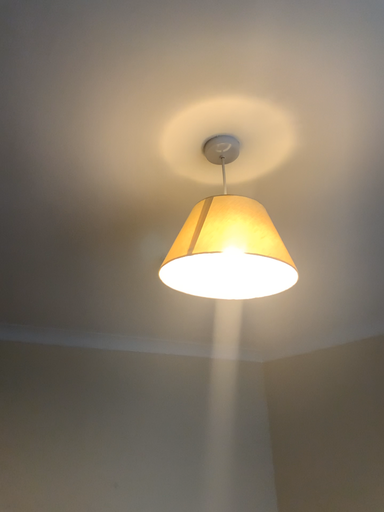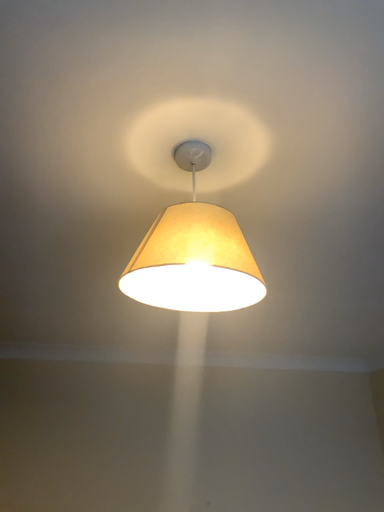
Question: How did the camera likely rotate when shooting the video?

Choices:
 (A) rotated right
 (B) rotated left

Answer: (B)